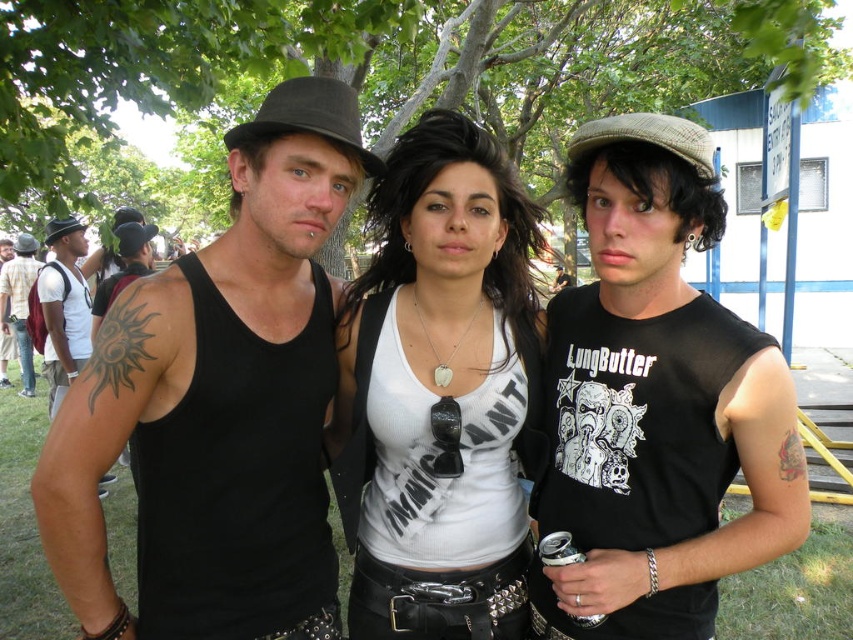
Question: Does black mesh tank top at center lie behind matte black tank top at left?

Choices:
 (A) yes
 (B) no

Answer: (B)

Question: Which point is farther to the camera?

Choices:
 (A) white matte tank top at center
 (B) matte black tank top at left

Answer: (B)

Question: Which object is the farthest from the black mesh tank top at center?

Choices:
 (A) black matte tank top at left
 (B) black matte tank top at center
 (C) matte black tank top at left
 (D) white matte tank top at center

Answer: (C)

Question: Is white matte tank top at center above black matte tank top at left?

Choices:
 (A) yes
 (B) no

Answer: (B)

Question: Which object appears closest to the camera in this image?

Choices:
 (A) white matte tank top at center
 (B) black matte tank top at left
 (C) matte black tank top at left
 (D) black matte tank top at center

Answer: (D)

Question: Does black matte tank top at center appear under black mesh tank top at center?

Choices:
 (A) yes
 (B) no

Answer: (B)